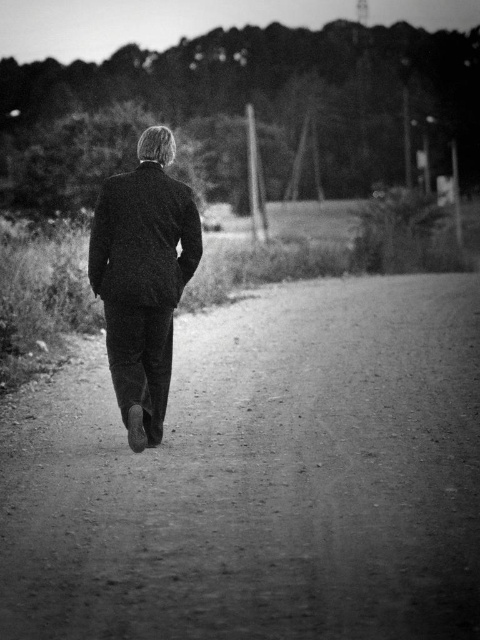
You are standing at the point labeled point (x=175, y=180) and want to walk towards the point labeled point (x=310, y=632). According to the scene description, will you be moving in the same direction as the person in the image?

Yes, because the path curves gently to the right as it extends into the distance, and point (x=310, y=632) is in front of point (x=175, y=180) along the path, so moving towards it would follow the path direction which matches the person walking away from the viewer.

You are an observer standing at the starting point of the dirt track at center. You notice the textured wool suit at center ahead of you. Which object is closer to the ground?

The dirt track at center is closer to the ground since it has a lesser height compared to the textured wool suit at center.